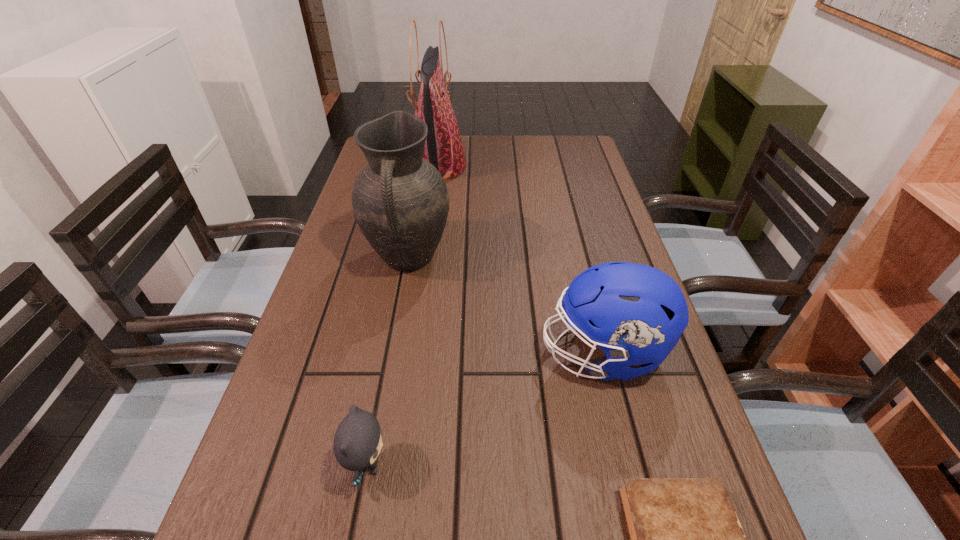
What are the coordinates of `vacant space that satisfies the following two spatial constraints: 1. on the front side of the handbag; 2. on the front-facing side of the kitten` in the screenshot? It's located at (396, 465).